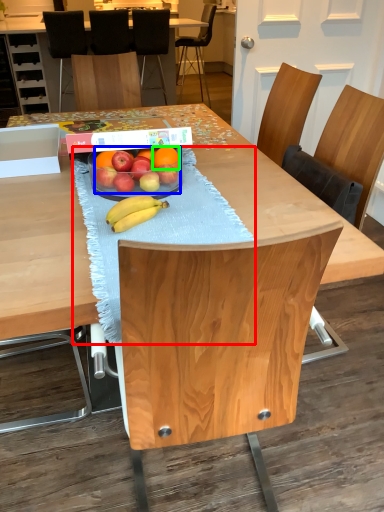
Question: Which object is positioned farthest from tablecloth (highlighted by a red box)? Select from grapefruit (highlighted by a blue box) and orange (highlighted by a green box).

Choices:
 (A) grapefruit
 (B) orange

Answer: (B)